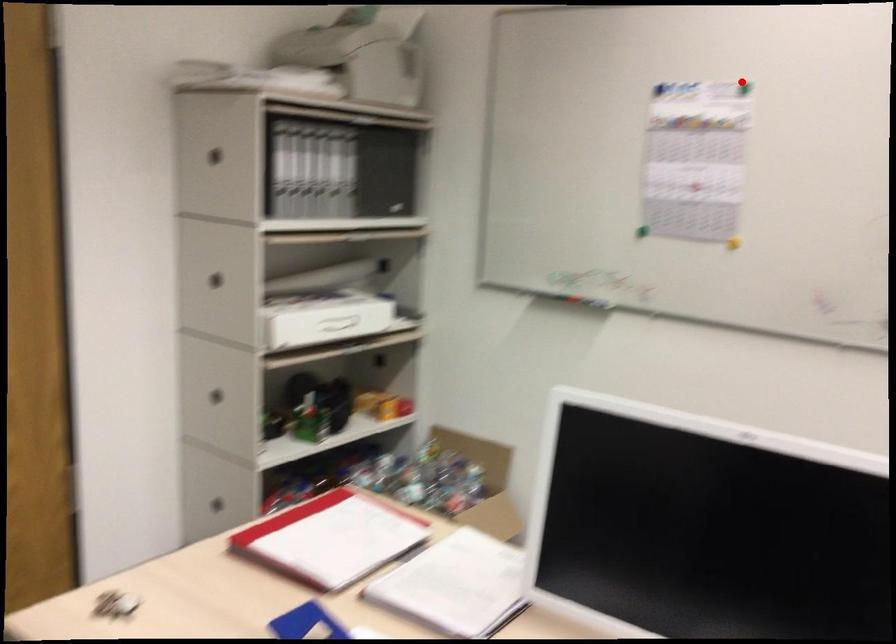
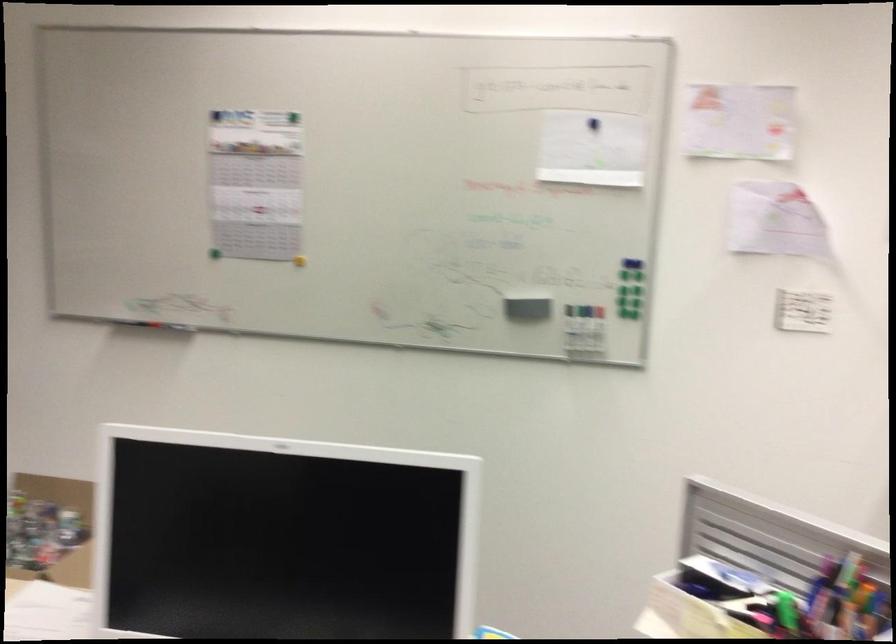
In the second image, find the point that corresponds to the highlighted location in the first image.

(293, 118)